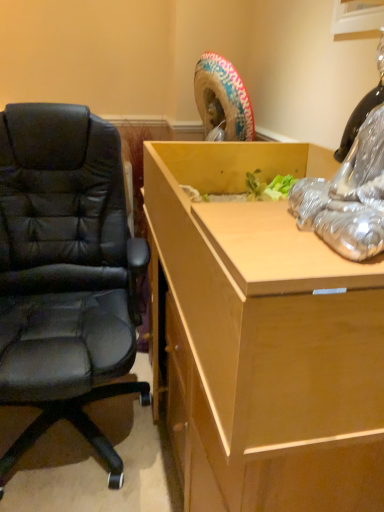
Question: Would you say black leather chair at left is to the left or to the right of light brown wood desk at center in the picture?

Choices:
 (A) left
 (B) right

Answer: (A)

Question: Is black leather chair at left taller or shorter than light brown wood desk at center?

Choices:
 (A) tall
 (B) short

Answer: (A)

Question: Is black leather chair at left in front of or behind light brown wood desk at center in the image?

Choices:
 (A) front
 (B) behind

Answer: (B)

Question: Considering their positions, is light brown wood desk at center located in front of or behind black leather chair at left?

Choices:
 (A) front
 (B) behind

Answer: (A)

Question: Is light brown wood desk at center taller or shorter than black leather chair at left?

Choices:
 (A) short
 (B) tall

Answer: (A)

Question: Is point (283, 505) positioned closer to the camera than point (59, 284)?

Choices:
 (A) closer
 (B) farther

Answer: (A)

Question: Is light brown wood desk at center wider or thinner than black leather chair at left?

Choices:
 (A) wide
 (B) thin

Answer: (B)